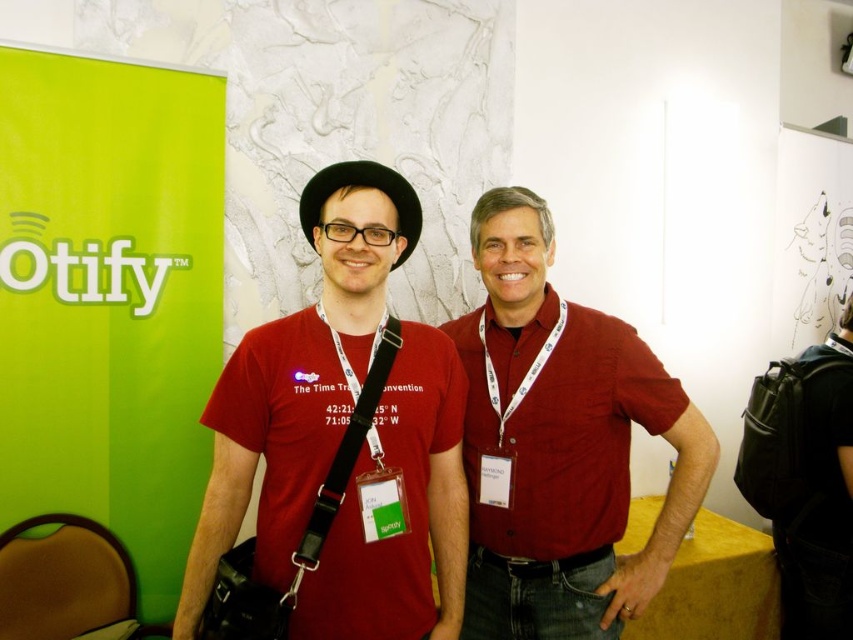
Can you confirm if matte red shirt at center is positioned below green fabric lanyard at center?

No, matte red shirt at center is not below green fabric lanyard at center.

Is matte red shirt at center smaller than green fabric lanyard at center?

No, matte red shirt at center is not smaller than green fabric lanyard at center.

The image size is (853, 640). Find the location of `matte red shirt at center`. matte red shirt at center is located at coordinates (560, 444).

I want to click on matte red shirt at center, so click(560, 444).

Is point (491, 260) closer to camera compared to point (498, 436)?

No.

Who is more forward, (631, 369) or (532, 358)?

Point (631, 369)

What do you see at coordinates (560, 444) in the screenshot? I see `matte red shirt at center` at bounding box center [560, 444].

Locate an element on the screen. matte red shirt at center is located at coordinates (560, 444).

Can you confirm if green fabric lanyard at center is positioned to the left of white/thick fabric lanyard at center?

Correct, you'll find green fabric lanyard at center to the left of white/thick fabric lanyard at center.

Does green fabric lanyard at center have a lesser height compared to white/thick fabric lanyard at center?

In fact, green fabric lanyard at center may be taller than white/thick fabric lanyard at center.

You are a GUI agent. You are given a task and a screenshot of the screen. Output one action in this format:
    pyautogui.click(x=<x>, y=<y>)
    Task: Click on the green fabric lanyard at center
    The height and width of the screenshot is (640, 853).
    Given the screenshot: What is the action you would take?
    pyautogui.click(x=345, y=452)